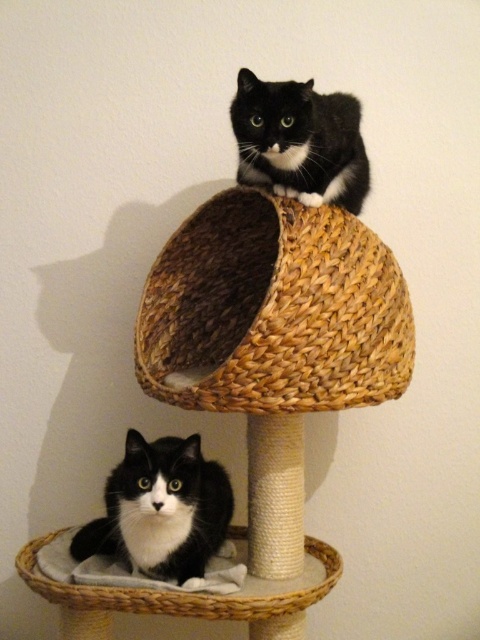
Can you confirm if woven straw basket at upper center is bigger than black and white fur cat at lower left?

Yes.

Is point (301, 216) positioned after point (154, 486)?

Yes.

Where is `woven straw basket at upper center`? woven straw basket at upper center is located at coordinates (274, 310).

Between black and white fur cat at lower left and woven fabric cat bed at lower center, which one appears on the right side from the viewer's perspective?

woven fabric cat bed at lower center

Is point (124, 525) positioned behind point (154, 593)?

Yes, point (124, 525) is behind point (154, 593).

Where is `black and white fur cat at lower left`? The image size is (480, 640). black and white fur cat at lower left is located at coordinates (160, 509).

Looking at this image, can you confirm if black and white fur cat at lower left is smaller than black matte fur cat at upper center?

No, black and white fur cat at lower left is not smaller than black matte fur cat at upper center.

What do you see at coordinates (160, 509) in the screenshot?
I see `black and white fur cat at lower left` at bounding box center [160, 509].

What are the coordinates of `black and white fur cat at lower left` in the screenshot? It's located at (160, 509).